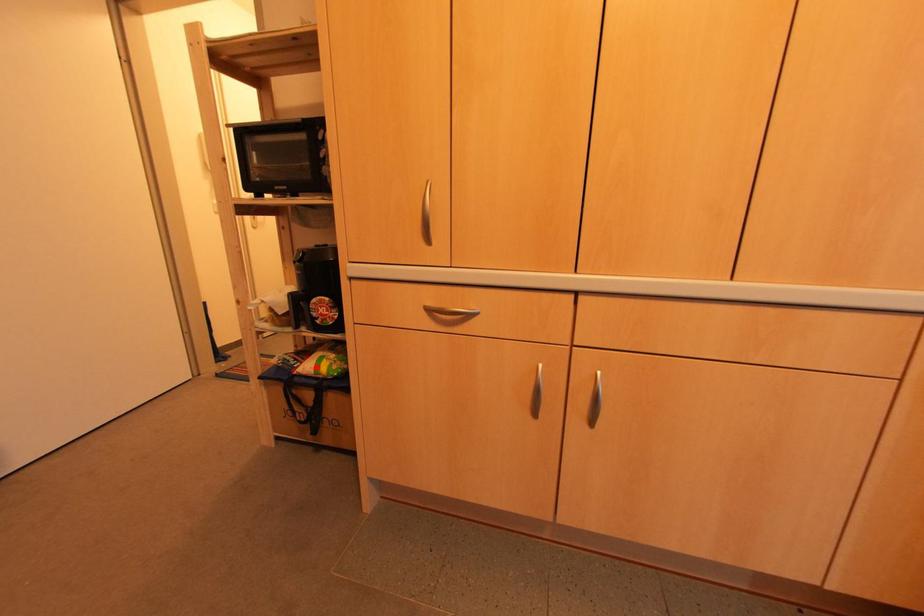
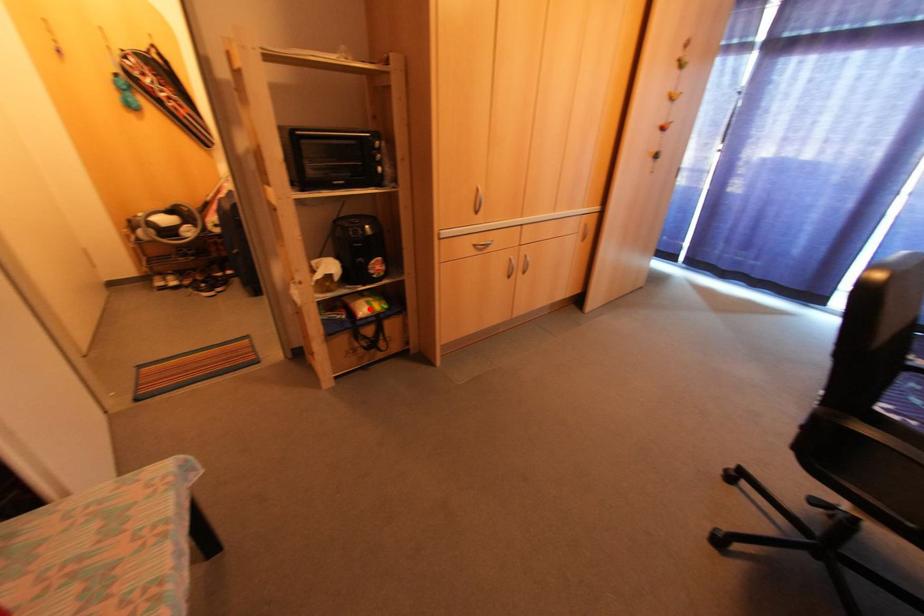
I am providing you with two images of the same scene from different viewpoints. A red point is marked on the first image and another point is marked on the second image. Do the highlighted points in image1 and image2 indicate the same real-world spot?

Yes